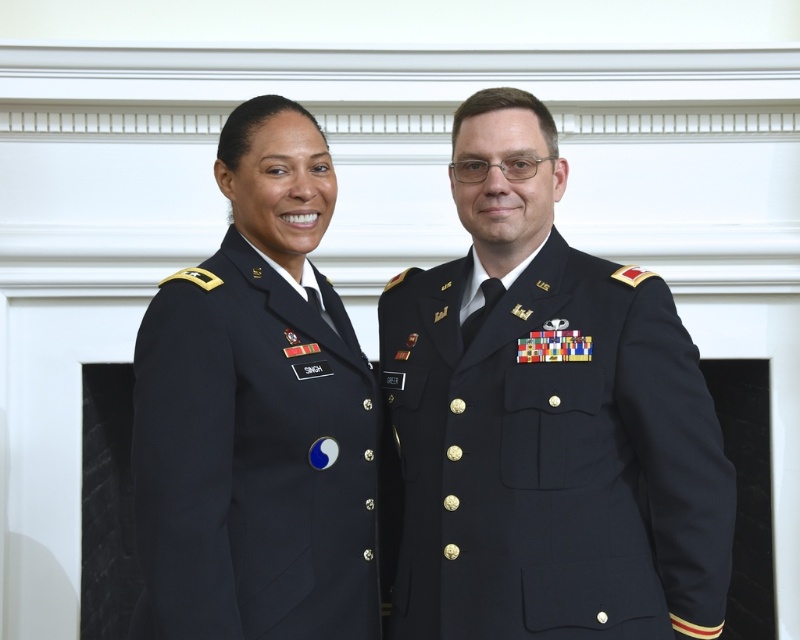
From the picture: You are a tailor who needs to determine which uniform requires more fabric for alterations. Based on the image, which uniform between the navy blue wool military uniform at center and the navy blue fabric uniform at left would need more fabric due to its size?

The navy blue wool military uniform at center requires more fabric for alterations because its width is larger than the navy blue fabric uniform at left.

You are a photographer setting up for a military portrait session. You need to ensure there is at least 1 inch of space between the two navy blue uniforms to avoid overlapping in the photo. Based on the scene description, will the current positioning of the navy blue uniform at center and the navy blue wool military uniform at center meet this requirement?

The navy blue uniform at center is only 0.85 inches from the navy blue wool military uniform at center, which is less than the required 1 inch of space. Therefore, the current positioning does not meet the requirement and the uniforms are too close to each other.

You are a photographer setting up a photo shoot with two navy blue uniforms. You need to adjust the camera focus so that the taller uniform is in focus. Which uniform should you focus on, the navy blue uniform at center or the navy blue fabric uniform at left?

The navy blue uniform at center is much taller than the navy blue fabric uniform at left, so you should focus on the navy blue uniform at center to ensure it is in focus.